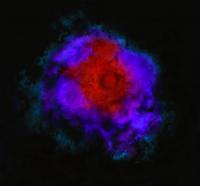
The image size is (200, 186). I want to click on corners, so click(197, 184), click(1, 184), click(1, 2), click(198, 0).